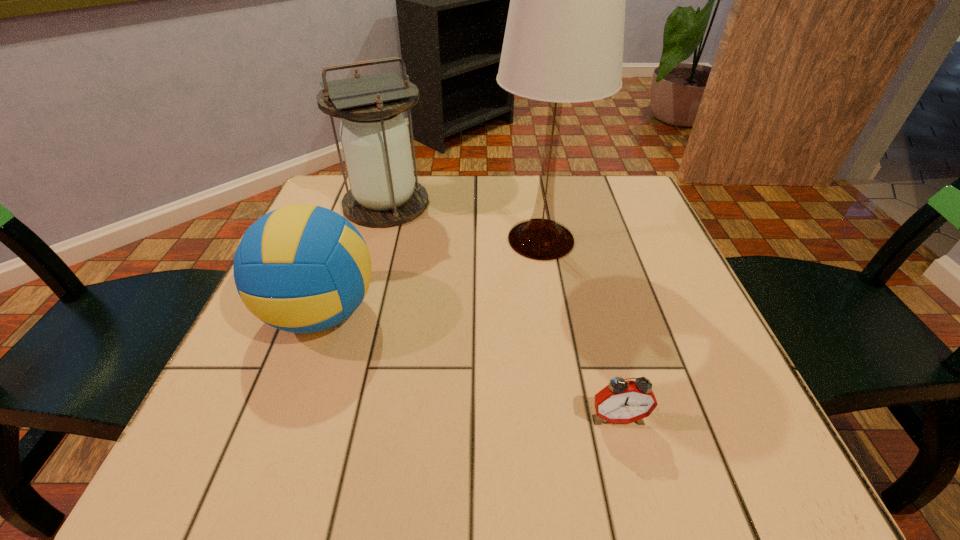
This screenshot has width=960, height=540. Find the location of `vacant area located 0.270m on the right of the second shortest object`. vacant area located 0.270m on the right of the second shortest object is located at coordinates (522, 313).

At what (x,y) coordinates should I click in order to perform the action: click on table lamp that is at the far edge. Please return your answer as a coordinate pair (x, y). Looking at the image, I should click on (563, 43).

This screenshot has height=540, width=960. In order to click on lantern present at the far edge in this screenshot , I will do `click(383, 193)`.

Identify the location of object located in the near edge section of the desktop. (621, 401).

The height and width of the screenshot is (540, 960). In order to click on lantern at the left edge in this screenshot , I will do `click(383, 193)`.

The image size is (960, 540). Find the location of `volleyball present at the left edge`. volleyball present at the left edge is located at coordinates (302, 268).

Image resolution: width=960 pixels, height=540 pixels. Identify the location of object that is at the far left corner. (383, 193).

The height and width of the screenshot is (540, 960). In the image, there is a desktop. What are the coordinates of `vacant space at the far edge` in the screenshot? It's located at (477, 210).

Locate an element on the screen. The height and width of the screenshot is (540, 960). free region at the near edge of the desktop is located at coordinates (415, 466).

In the image, there is a desktop. Identify the location of vacant space at the left edge. (280, 357).